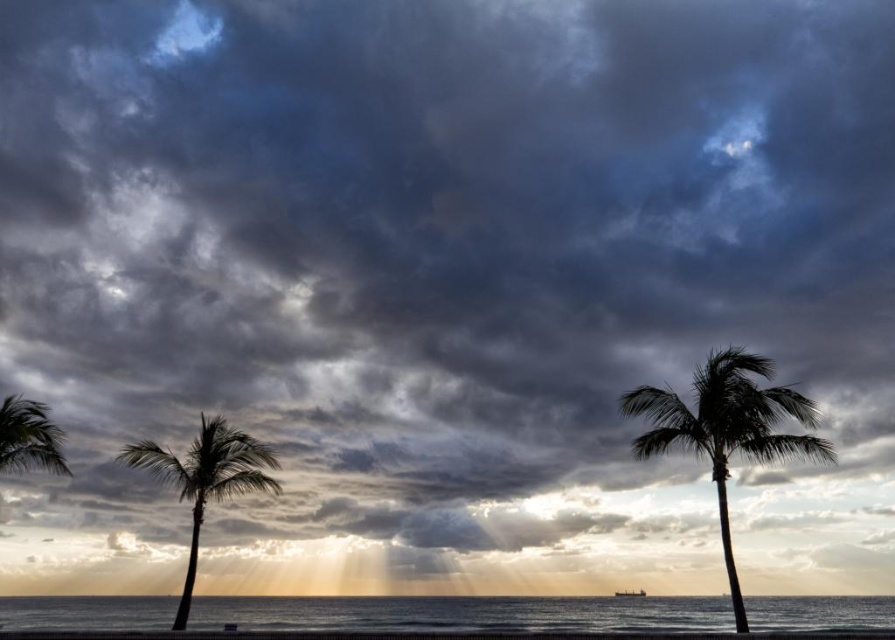
Question: Is silhouette palm tree at right positioned at the back of silky brown palm tree at left?

Choices:
 (A) yes
 (B) no

Answer: (B)

Question: Based on their relative distances, which object is nearer to the silky brown palm tree at left?

Choices:
 (A) green leafy palm tree at lower left
 (B) silhouette palm tree at right

Answer: (A)

Question: Is the position of clear water at lower center less distant than that of silky brown palm tree at left?

Choices:
 (A) no
 (B) yes

Answer: (B)

Question: Estimate the real-world distances between objects in this image. Which object is farther from the silky brown palm tree at left?

Choices:
 (A) green leafy palm tree at lower left
 (B) clear water at lower center
 (C) silhouette palm tree at right

Answer: (C)

Question: Is silhouette palm tree at right smaller than green leafy palm tree at lower left?

Choices:
 (A) no
 (B) yes

Answer: (A)

Question: Considering the real-world distances, which object is closest to the silky brown palm tree at left?

Choices:
 (A) silhouette palm tree at right
 (B) green leafy palm tree at lower left

Answer: (B)